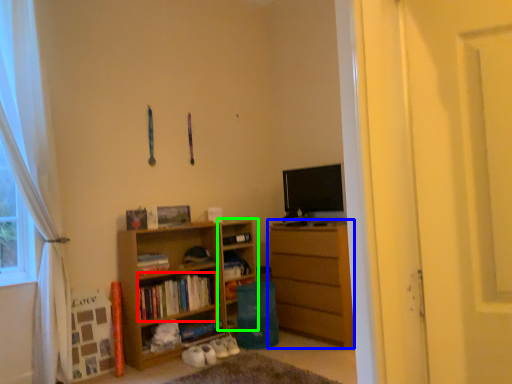
Question: Which is nearer to the book (highlighted by a red box)? chest of drawers (highlighted by a blue box) or cabinet (highlighted by a green box).

Choices:
 (A) chest of drawers
 (B) cabinet

Answer: (B)